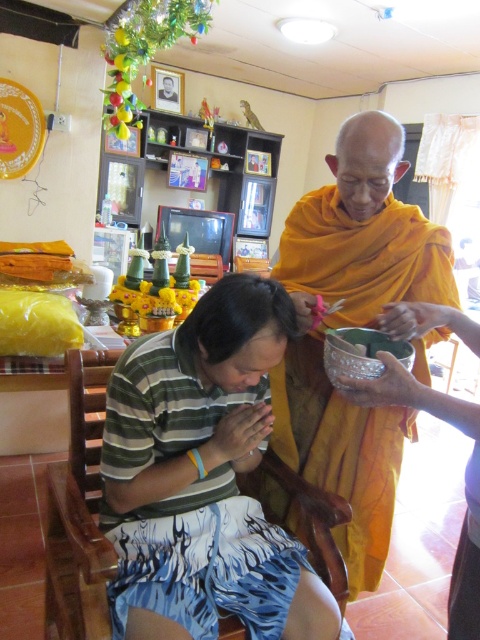
Looking at this image, does orange cloth at upper right come behind wooden chair at lower center?

Yes.

Between orange cloth at upper right and wooden chair at lower center, which one appears on the left side from the viewer's perspective?

Positioned to the left is wooden chair at lower center.

Which is in front, point (379, 426) or point (80, 490)?

Point (80, 490) is more forward.

I want to click on orange cloth at upper right, so click(355, 324).

Who is lower down, wooden chair at lower center or black matte hair at center?

wooden chair at lower center is lower down.

The width and height of the screenshot is (480, 640). I want to click on wooden chair at lower center, so click(x=80, y=467).

The image size is (480, 640). I want to click on wooden chair at lower center, so click(x=80, y=467).

Is the position of orange cloth at upper right more distant than that of black matte hair at center?

Yes, it is.

Describe the element at coordinates (355, 324) in the screenshot. I see `orange cloth at upper right` at that location.

Which is behind, point (319, 224) or point (230, 330)?

The point (319, 224) is more distant.

You are a GUI agent. You are given a task and a screenshot of the screen. Output one action in this format:
    pyautogui.click(x=<x>, y=<y>)
    Task: Click on the orange cloth at upper right
    This screenshot has height=640, width=480.
    Given the screenshot: What is the action you would take?
    pyautogui.click(x=355, y=324)